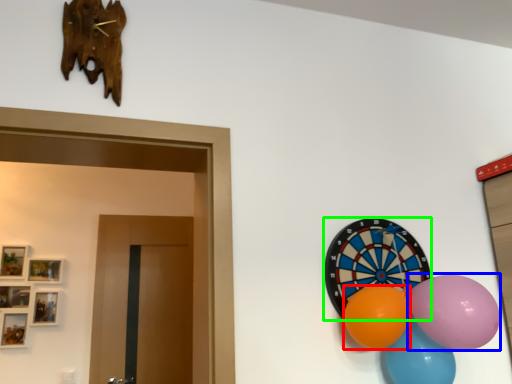
Question: Which object is the farthest from balloon (highlighted by a red box)? Choose among these: balloon (highlighted by a blue box) or oval (highlighted by a green box).

Choices:
 (A) balloon
 (B) oval

Answer: (B)